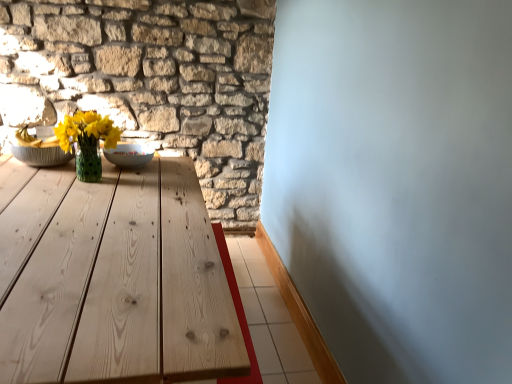
Question: In terms of height, does natural stone wall at upper left look taller or shorter compared to white glossy bowl at center?

Choices:
 (A) tall
 (B) short

Answer: (A)

Question: Looking at their shapes, would you say natural stone wall at upper left is wider or thinner than white glossy bowl at center?

Choices:
 (A) wide
 (B) thin

Answer: (B)

Question: Which object is the farthest from the natural stone wall at upper left?

Choices:
 (A) white glossy bowl at center
 (B) matte green vase at center-left

Answer: (A)

Question: Based on their relative distances, which object is nearer to the white glossy bowl at center?

Choices:
 (A) matte green vase at center-left
 (B) natural stone wall at upper left

Answer: (A)